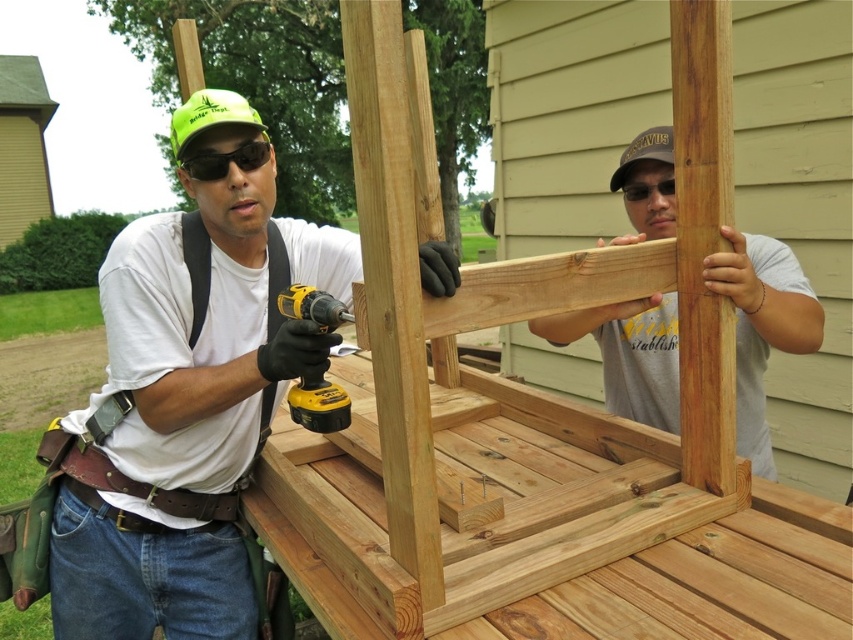
Question: Does matte black drill at center appear under light brown wood at center?

Choices:
 (A) yes
 (B) no

Answer: (A)

Question: Among these points, which one is nearest to the camera?

Choices:
 (A) (764, 241)
 (B) (236, 214)
 (C) (323, 308)

Answer: (C)

Question: Can you confirm if light brown wood at center is wider than green matte/glossy goggles at upper center?

Choices:
 (A) no
 (B) yes

Answer: (B)

Question: Estimate the real-world distances between objects in this image. Which object is farther from the green matte/glossy goggles at upper center?

Choices:
 (A) yellow/black cordless drill at center
 (B) light brown wood at center
 (C) matte black drill at center

Answer: (B)

Question: Which object is farther from the camera taking this photo?

Choices:
 (A) light brown wood at center
 (B) green matte/glossy goggles at upper center
 (C) yellow/black cordless drill at center

Answer: (B)

Question: Is light brown wood at center positioned in front of yellow/black cordless drill at center?

Choices:
 (A) no
 (B) yes

Answer: (A)